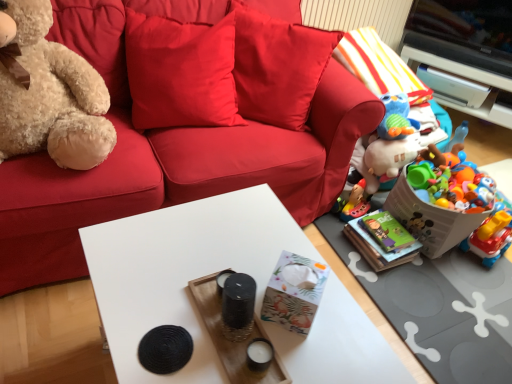
Where is `vacant space that is to the left of floral paper tissue box at center, the 2th box viewed from the right`? This screenshot has height=384, width=512. vacant space that is to the left of floral paper tissue box at center, the 2th box viewed from the right is located at coordinates (216, 317).